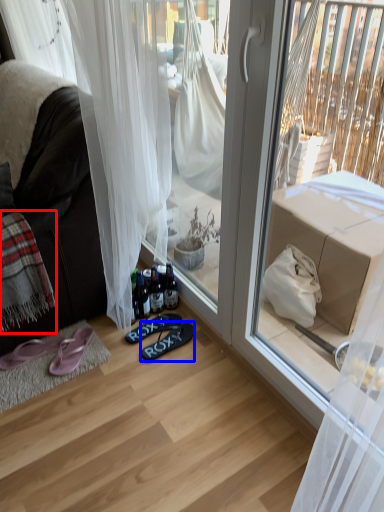
Question: Which point is further to the camera, blanket (highlighted by a red box) or footwear (highlighted by a blue box)?

Choices:
 (A) blanket
 (B) footwear

Answer: (B)